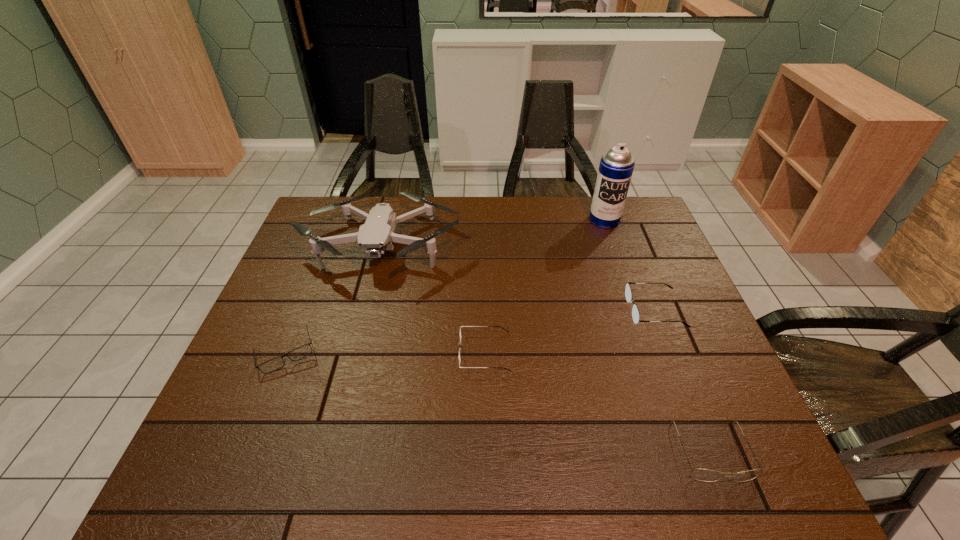
Find the location of a particular element. vacant area situated on the lenses of the third farthest object is located at coordinates [505, 310].

At what (x,y) coordinates should I click in order to perform the action: click on free spot located 0.140m with the lenses facing outward on the leftmost spectacles. Please return your answer as a coordinate pair (x, y). This screenshot has height=540, width=960. Looking at the image, I should click on (254, 431).

Where is `vacant space located 0.190m on the front-facing side of the third object from left to right`? Image resolution: width=960 pixels, height=540 pixels. vacant space located 0.190m on the front-facing side of the third object from left to right is located at coordinates (380, 353).

This screenshot has height=540, width=960. Identify the location of free space located on the front-facing side of the third object from left to right. (335, 353).

Where is `vacant region located on the front-facing side of the third object from left to right`? Image resolution: width=960 pixels, height=540 pixels. vacant region located on the front-facing side of the third object from left to right is located at coordinates (426, 353).

Where is `aerosol can situated at the far edge`? The height and width of the screenshot is (540, 960). aerosol can situated at the far edge is located at coordinates (616, 167).

Identify the location of drone located at the far edge. The image size is (960, 540). tap(375, 236).

Where is `object that is at the near edge`? object that is at the near edge is located at coordinates (705, 475).

In order to click on drone that is at the left edge in this screenshot , I will do `click(375, 236)`.

The height and width of the screenshot is (540, 960). I want to click on spectacles that is at the left edge, so click(x=301, y=352).